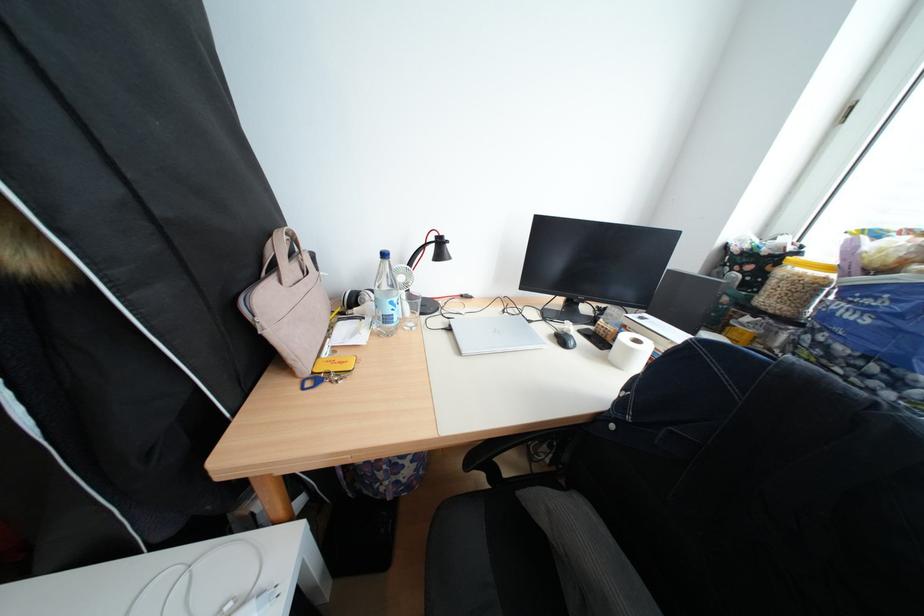
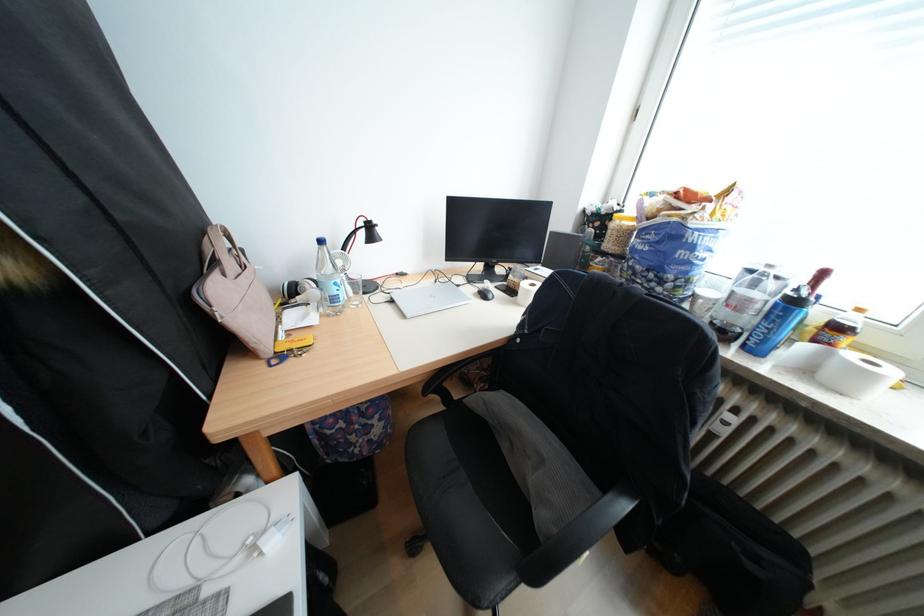
Locate, in the second image, the point that corresponds to (x=399, y=320) in the first image.

(346, 300)